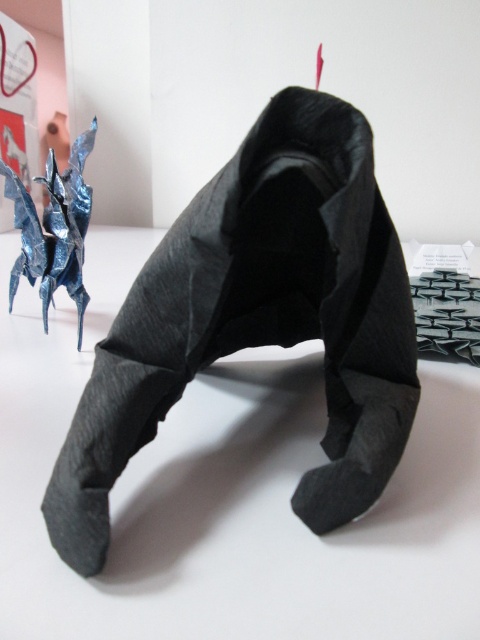
Question: Can you confirm if black paper sculpture at center is wider than metallic blue origami dragon at upper left?

Choices:
 (A) no
 (B) yes

Answer: (B)

Question: Which of the following is the farthest from the observer?

Choices:
 (A) (392, 374)
 (B) (60, 253)

Answer: (B)

Question: Can you confirm if black paper sculpture at center is thinner than metallic blue origami dragon at upper left?

Choices:
 (A) no
 (B) yes

Answer: (A)

Question: Can you confirm if black paper sculpture at center is positioned below metallic blue origami dragon at upper left?

Choices:
 (A) no
 (B) yes

Answer: (B)